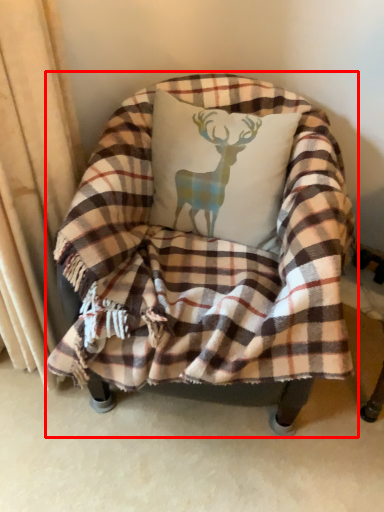
Question: Where is chair (annotated by the red box) located in relation to throw pillow in the image?

Choices:
 (A) left
 (B) right

Answer: (A)